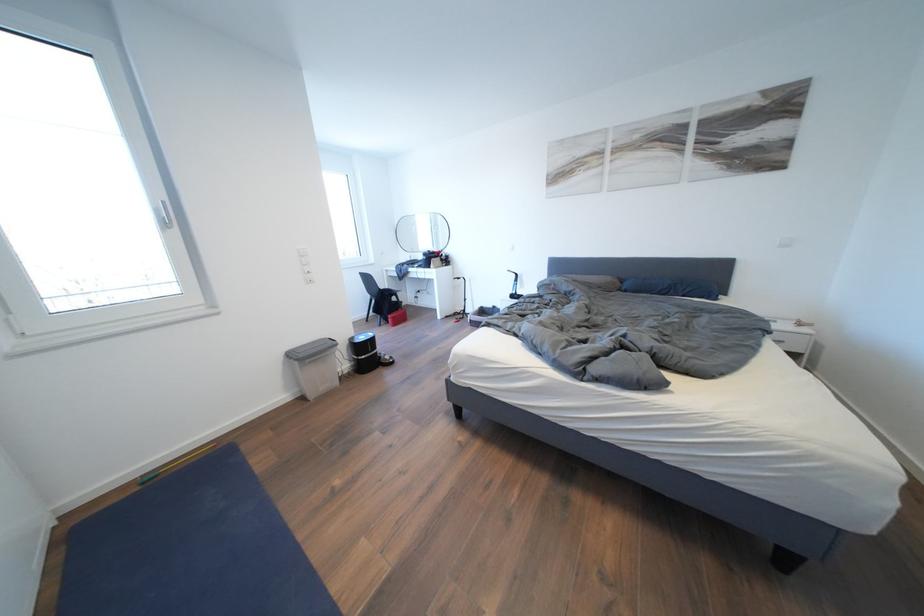
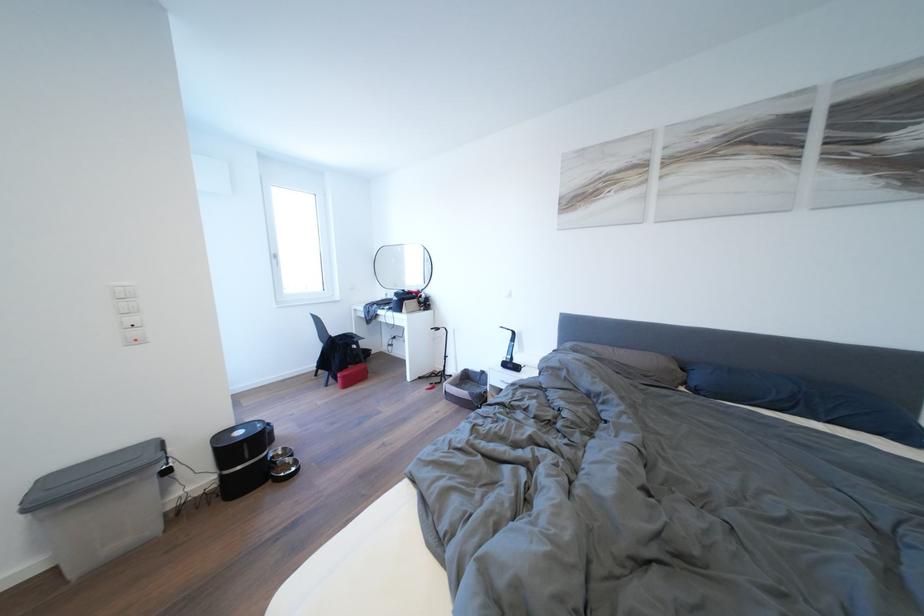
Based on the photo, in a continuous first-person perspective shot, in which direction is the camera moving?

The cameraman moved toward right, forward.